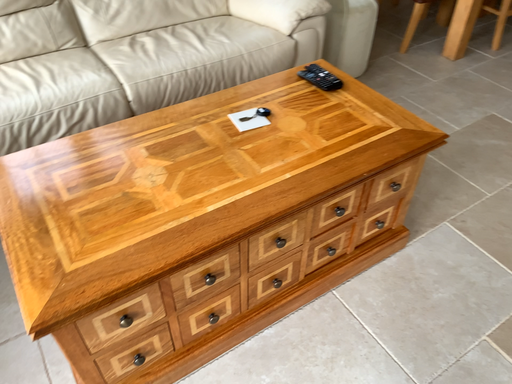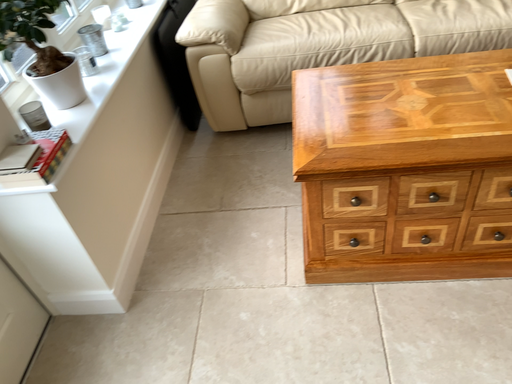
Question: How did the camera likely rotate when shooting the video?

Choices:
 (A) rotated left
 (B) rotated right

Answer: (A)